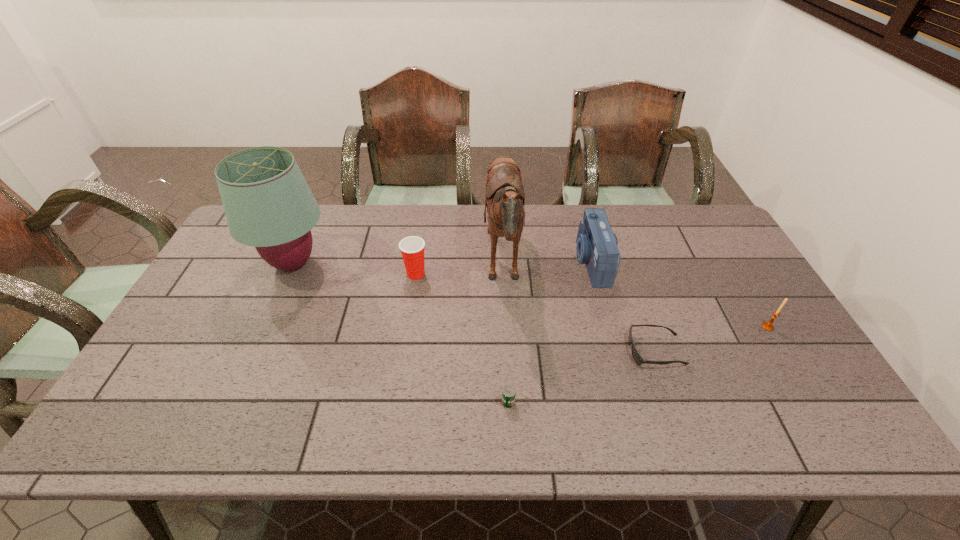
At what (x,y) coordinates should I click in order to perform the action: click on vacant region located on the back of the saddle. Please return your answer as a coordinate pair (x, y). Looking at the image, I should click on (413, 265).

I want to click on vacant area situated on the back of the saddle, so click(448, 265).

Find the location of a particular element. The image size is (960, 540). free region located 0.220m on the back of the saddle is located at coordinates (413, 265).

Image resolution: width=960 pixels, height=540 pixels. Identify the location of blank space located on the front of the lampshade. (269, 318).

At what (x,y) coordinates should I click in order to perform the action: click on vacant space located 0.370m on the lens of the camera. Please return your answer as a coordinate pair (x, y). The height and width of the screenshot is (540, 960). Looking at the image, I should click on (460, 262).

This screenshot has width=960, height=540. Identify the location of free space located 0.110m on the lens of the camera. (541, 262).

What are the coordinates of `free spot located 0.120m on the lens of the camera` in the screenshot? It's located at (539, 262).

The width and height of the screenshot is (960, 540). I want to click on vacant space located on the back of the Dixie cup, so click(421, 234).

Image resolution: width=960 pixels, height=540 pixels. Find the location of `free point located 0.150m on the back of the third nearest object`. free point located 0.150m on the back of the third nearest object is located at coordinates (742, 285).

Locate an element on the screen. The image size is (960, 540). vacant point located 0.340m on the back of the nearest object is located at coordinates (502, 282).